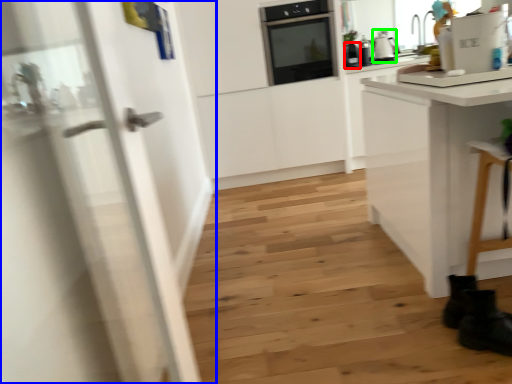
Question: Which object is the closest to the kitchen appliance (highlighted by a red box)? Choose among these: door (highlighted by a blue box) or kitchen appliance (highlighted by a green box).

Choices:
 (A) door
 (B) kitchen appliance

Answer: (B)